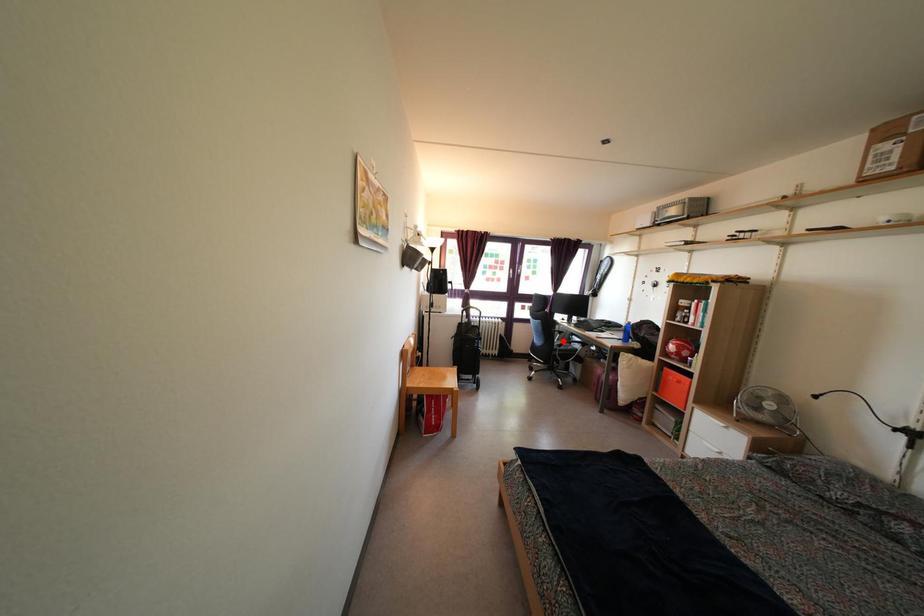
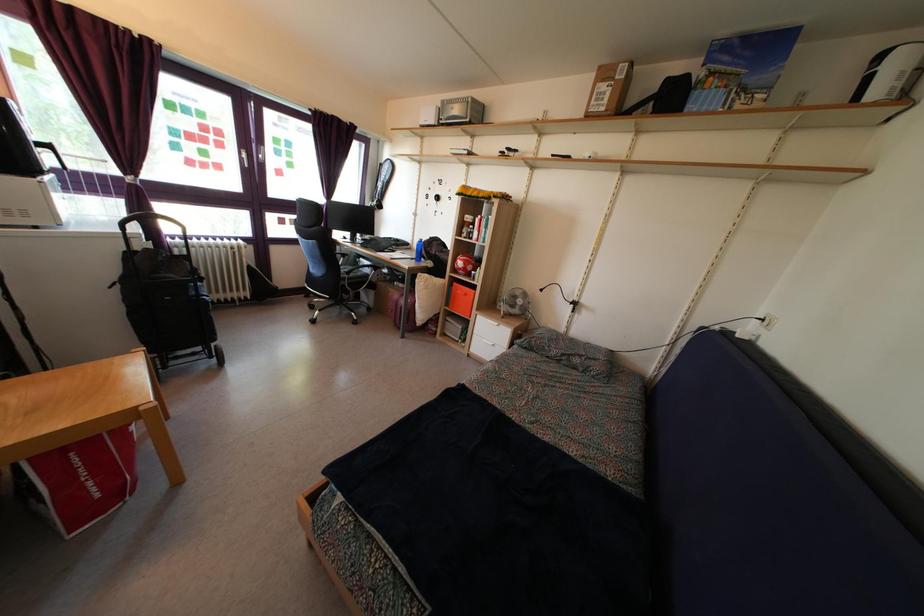
Question: I am providing you with two images of the same scene from different viewpoints. Given a red point in image1, look at the same physical point in image2. Is it:

Choices:
 (A) Closer to the viewpoint
 (B) Farther from the viewpoint

Answer: (A)